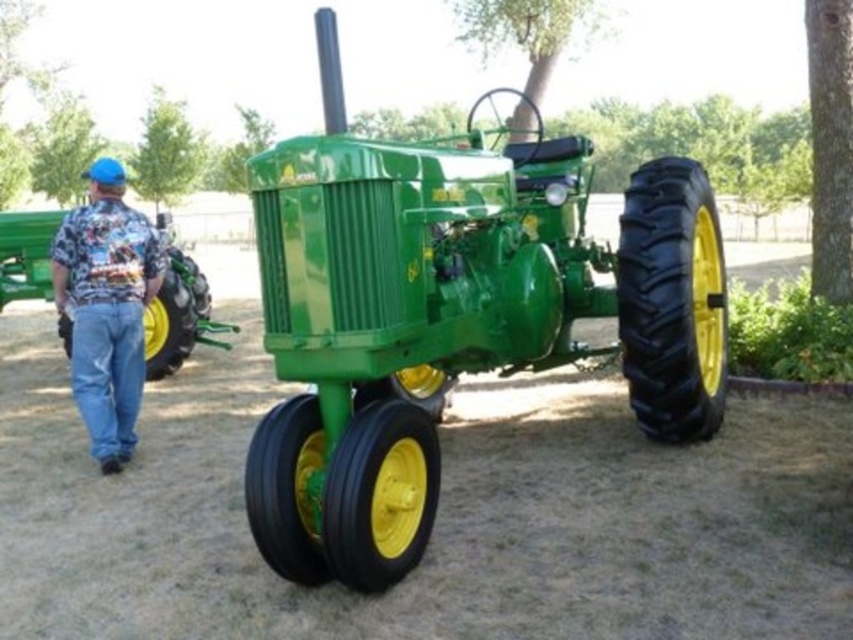
Does green polished metal tractor at center have a lesser width compared to floral shirt at left?

Incorrect, green polished metal tractor at center's width is not less than floral shirt at left's.

Between green polished metal tractor at center and floral shirt at left, which one has less height?

With less height is floral shirt at left.

Which is in front, point (561, 176) or point (93, 250)?

Positioned in front is point (93, 250).

At what (x,y) coordinates should I click in order to perform the action: click on green polished metal tractor at center. Please return your answer as a coordinate pair (x, y). The width and height of the screenshot is (853, 640). Looking at the image, I should click on (450, 316).

Who is lower down, green polished metal tractor at center or green matte tractor at left?

Positioned lower is green matte tractor at left.

Image resolution: width=853 pixels, height=640 pixels. What do you see at coordinates (450, 316) in the screenshot?
I see `green polished metal tractor at center` at bounding box center [450, 316].

Find the location of a particular element. green polished metal tractor at center is located at coordinates point(450,316).

Does floral shirt at left have a greater width compared to green matte tractor at left?

Incorrect, floral shirt at left's width does not surpass green matte tractor at left's.

Between point (117, 326) and point (36, 253), which one is positioned behind?

Point (36, 253)

The width and height of the screenshot is (853, 640). I want to click on floral shirt at left, so click(106, 307).